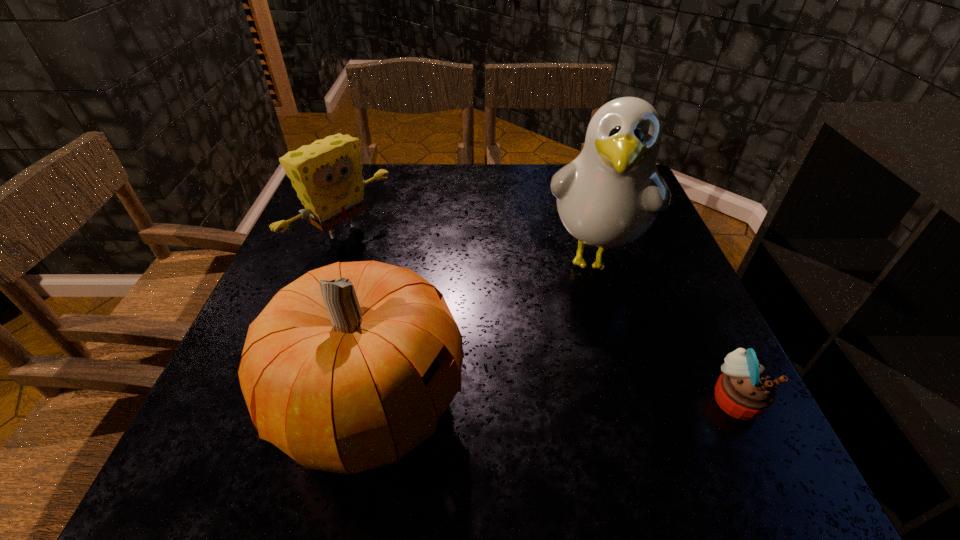
What are the coordinates of `vacant spot on the desktop that is between the third shortest object and the rightmost object and is positioned on the beak of the tallest object` in the screenshot? It's located at (566, 402).

This screenshot has width=960, height=540. I want to click on vacant space on the desktop that is between the second tallest object and the muffin and is positioned on the face of the third tallest object, so click(600, 401).